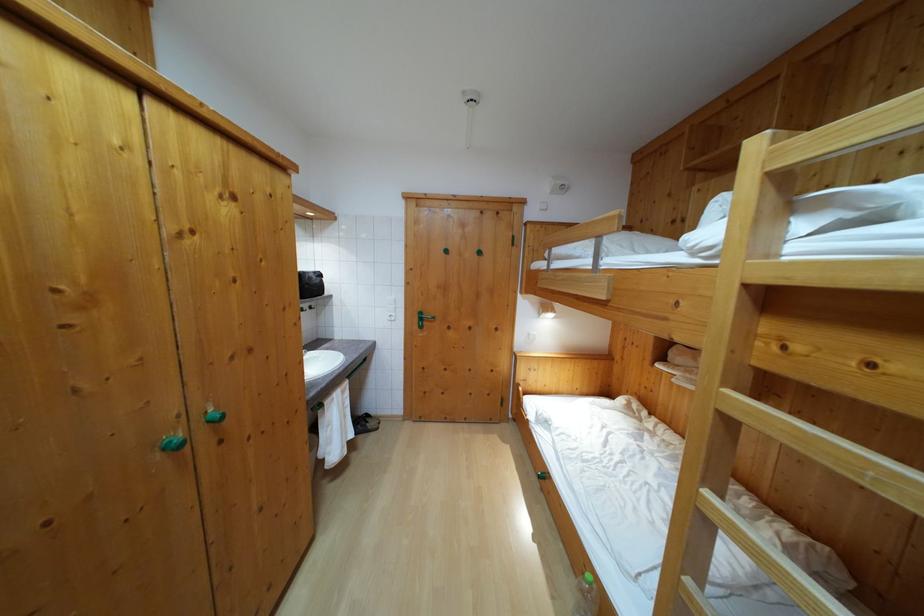
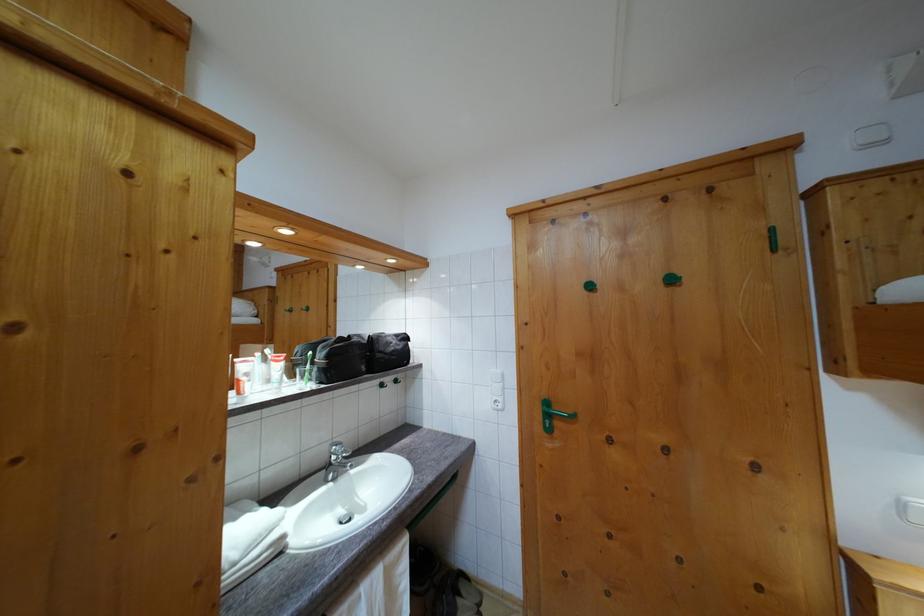
Find the pixel in the second image that matches [396,314] in the first image.

(504, 392)